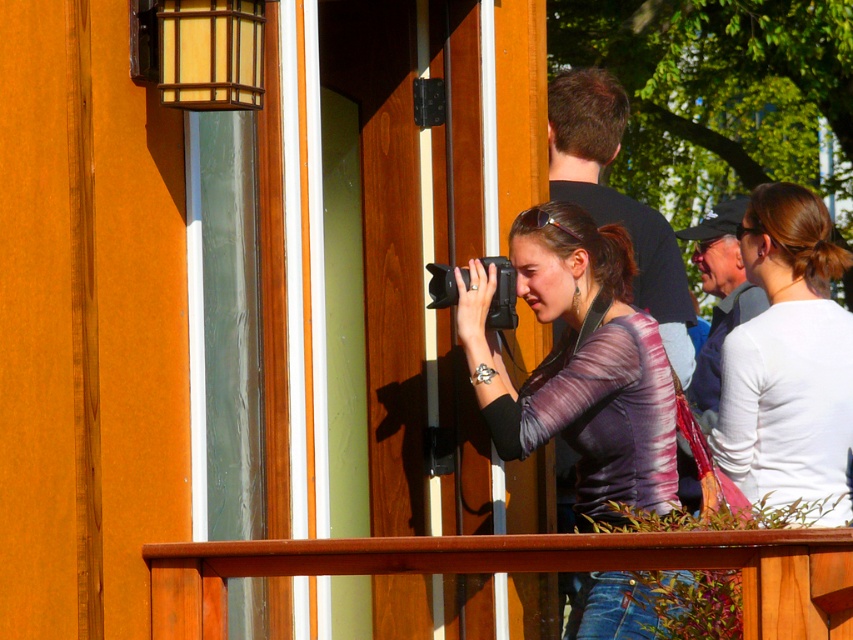
Is point (685, 353) positioned behind point (724, 308)?

No, it is in front of (724, 308).

Locate an element on the screen. This screenshot has height=640, width=853. dark blue shirt at center is located at coordinates (618, 198).

Where is `dark blue shirt at center`? dark blue shirt at center is located at coordinates (618, 198).

Does white matte shirt at upper right appear on the right side of dark blue shirt at center?

Yes, white matte shirt at upper right is to the right of dark blue shirt at center.

You are a GUI agent. You are given a task and a screenshot of the screen. Output one action in this format:
    pyautogui.click(x=<x>, y=<y>)
    Task: Click on the white matte shirt at upper right
    The width and height of the screenshot is (853, 640).
    Given the screenshot: What is the action you would take?
    pyautogui.click(x=788, y=360)

Is point (729, 401) positioned in front of point (553, 172)?

Yes, point (729, 401) is in front of point (553, 172).

Locate an element on the screen. The width and height of the screenshot is (853, 640). white matte shirt at upper right is located at coordinates (788, 360).

Can you confirm if gray fabric cap at upper right is taller than black plastic camera at center?

Yes, gray fabric cap at upper right is taller than black plastic camera at center.

Is gray fabric cap at upper right to the left of black plastic camera at center from the viewer's perspective?

Incorrect, gray fabric cap at upper right is not on the left side of black plastic camera at center.

Identify the location of gray fabric cap at upper right. (718, 294).

This screenshot has height=640, width=853. What are the coordinates of `gray fabric cap at upper right` in the screenshot? It's located at (718, 294).